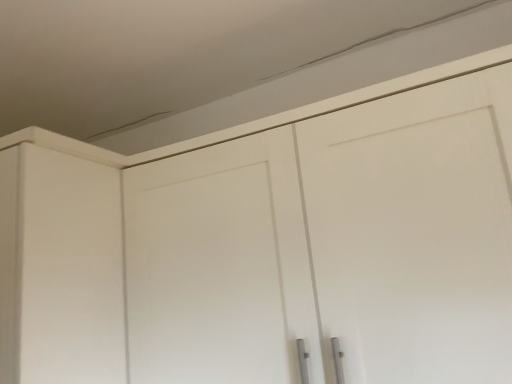
Describe the element at coordinates (415, 231) in the screenshot. I see `white matte cabinet door at upper center` at that location.

What is the approximate height of white matte cabinet door at upper center?

white matte cabinet door at upper center is 25.74 inches tall.

This screenshot has width=512, height=384. I want to click on white matte cabinet door at upper center, so click(x=415, y=231).

Identify the location of white matte cabinet door at upper center. pos(415,231).